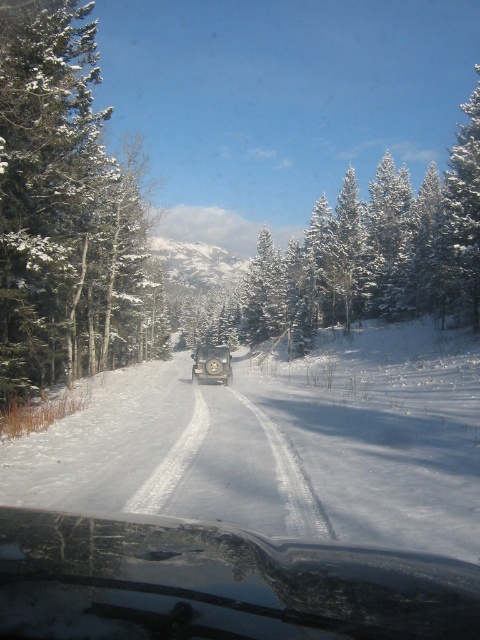
You are a passenger in the vehicle and want to check if the transparent glass windshield at center is obstructed by any snow. Based on the scene description, can you determine if the windshield is clear?

The transparent glass windshield at center is described as transparent, which means it is clear and not obstructed by snow.

Based on the scene description, where is the point located at coordinates [282,445]?

The point at coordinates [282,445] is located on the white powdery snow at center.